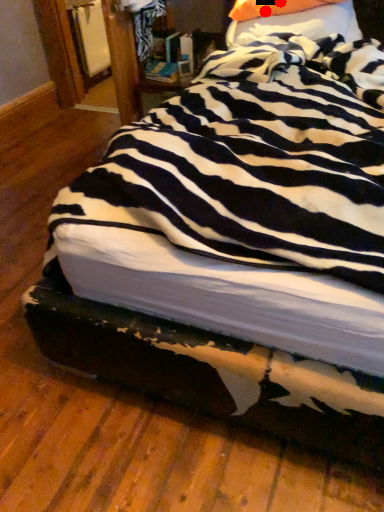
Question: Two points are circled on the image, labeled by A and B beside each circle. Which point appears closest to the camera in this image?

Choices:
 (A) A is closer
 (B) B is closer

Answer: (A)